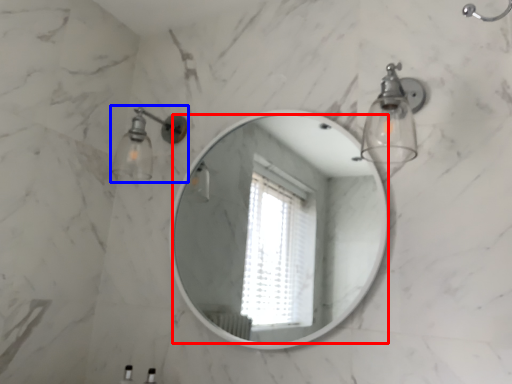
Question: Which point is further to the camera, mirror (highlighted by a red box) or light fixture (highlighted by a blue box)?

Choices:
 (A) mirror
 (B) light fixture

Answer: (B)